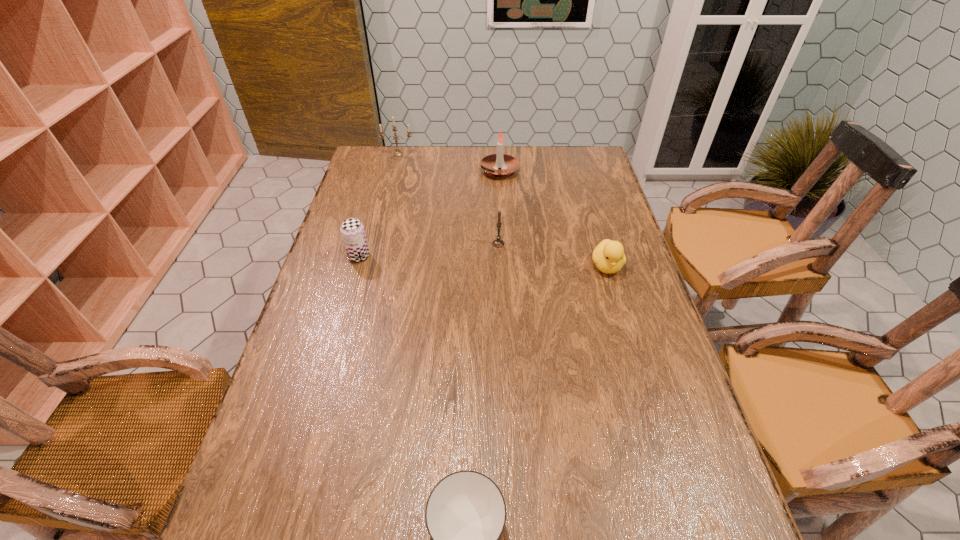
Where is `object that is the fifth nearest to the beer can`? object that is the fifth nearest to the beer can is located at coordinates (465, 514).

I want to click on the second closest candle to the second farthest candle, so click(498, 243).

Locate an element on the screen. the closest candle relative to the third farthest object is located at coordinates tap(490, 164).